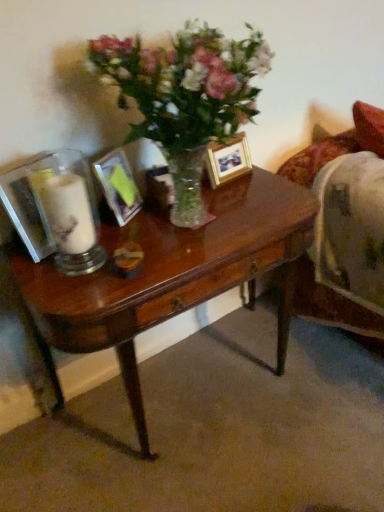
Question: Is metallic silver picture frame at center, the 1th picture frame viewed from the left, at the back of shiny brown desk at center?

Choices:
 (A) yes
 (B) no

Answer: (B)

Question: Is shiny brown desk at center positioned far away from metallic silver picture frame at center, arranged as the first picture frame when viewed from the front?

Choices:
 (A) no
 (B) yes

Answer: (A)

Question: From a real-world perspective, is shiny brown desk at center on metallic silver picture frame at center, arranged as the first picture frame when viewed from the front?

Choices:
 (A) no
 (B) yes

Answer: (A)

Question: From a real-world perspective, is shiny brown desk at center beneath metallic silver picture frame at center, the 1th picture frame viewed from the left?

Choices:
 (A) yes
 (B) no

Answer: (A)

Question: From the image's perspective, is shiny brown desk at center above metallic silver picture frame at center, arranged as the first picture frame when viewed from the front?

Choices:
 (A) no
 (B) yes

Answer: (A)

Question: From a real-world perspective, is wooden photo frame at center, which is counted as the 1th picture frame, starting from the right, positioned above or below white matte candle at left?

Choices:
 (A) above
 (B) below

Answer: (B)

Question: From the image's perspective, is wooden photo frame at center, which is counted as the 1th picture frame, starting from the right, positioned above or below white matte candle at left?

Choices:
 (A) below
 (B) above

Answer: (B)

Question: Based on their positions, is wooden photo frame at center, the 2th picture frame positioned from the front, located to the left or right of white matte candle at left?

Choices:
 (A) left
 (B) right

Answer: (B)

Question: Is wooden photo frame at center, which is the second picture frame in left-to-right order, bigger or smaller than white matte candle at left?

Choices:
 (A) small
 (B) big

Answer: (A)

Question: Considering the positions of white matte candle at left and shiny brown desk at center in the image, is white matte candle at left taller or shorter than shiny brown desk at center?

Choices:
 (A) tall
 (B) short

Answer: (B)

Question: Visually, is white matte candle at left positioned to the left or to the right of shiny brown desk at center?

Choices:
 (A) right
 (B) left

Answer: (B)

Question: From the image's perspective, is white matte candle at left above or below shiny brown desk at center?

Choices:
 (A) below
 (B) above

Answer: (B)

Question: Based on their sizes in the image, would you say white matte candle at left is bigger or smaller than shiny brown desk at center?

Choices:
 (A) big
 (B) small

Answer: (B)

Question: In terms of height, does metallic silver picture frame at center, the 1th picture frame viewed from the left, look taller or shorter compared to wooden photo frame at center, which is the first picture frame from back to front?

Choices:
 (A) short
 (B) tall

Answer: (B)

Question: From a real-world perspective, is metallic silver picture frame at center, arranged as the first picture frame when viewed from the front, above or below wooden photo frame at center, which is the second picture frame in left-to-right order?

Choices:
 (A) above
 (B) below

Answer: (A)